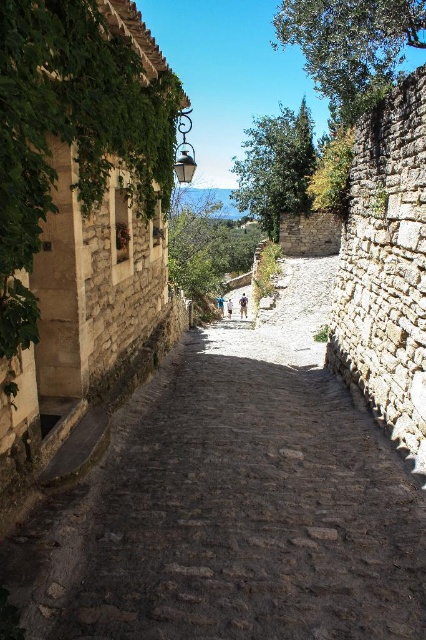
Which of these two, brown cobblestone path at center or green leafy ivy at upper left, stands shorter?

green leafy ivy at upper left

Is brown cobblestone path at center to the left of green leafy ivy at upper left from the viewer's perspective?

In fact, brown cobblestone path at center is to the right of green leafy ivy at upper left.

Describe the element at coordinates (233, 502) in the screenshot. I see `brown cobblestone path at center` at that location.

Image resolution: width=426 pixels, height=640 pixels. Identify the location of brown cobblestone path at center. point(233,502).